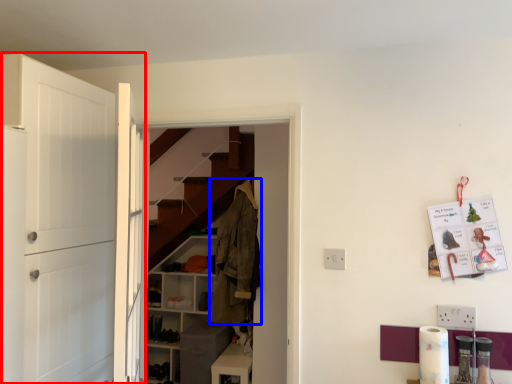
Question: Which object appears farthest to the camera in this image, door (highlighted by a red box) or clothing (highlighted by a blue box)?

Choices:
 (A) door
 (B) clothing

Answer: (B)